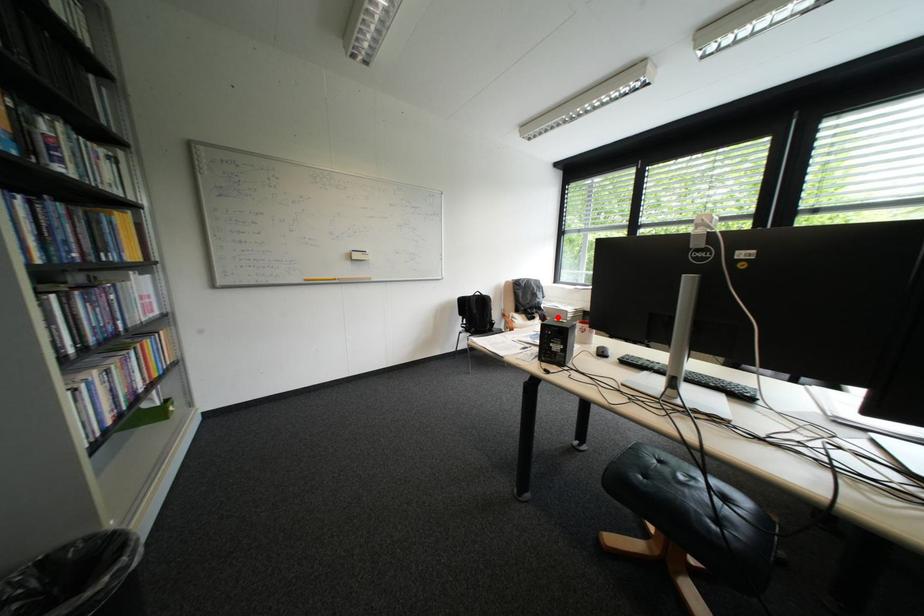
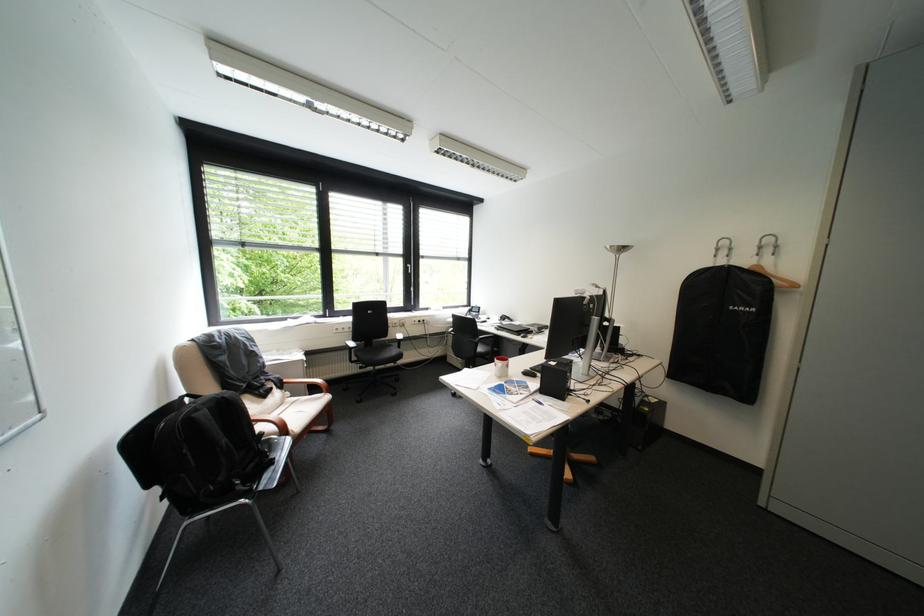
Question: A red point is marked in image1. In image2, is the corresponding 3D point closer to the camera or farther? Reply with the corresponding letter.

Choices:
 (A) The corresponding 3D point is closer.
 (B) The corresponding 3D point is farther.

Answer: (A)